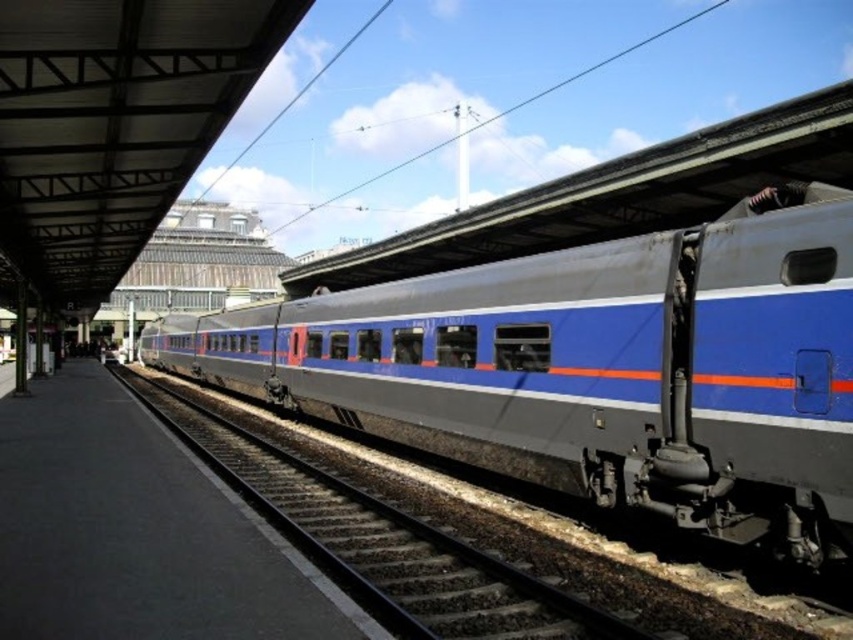
Question: Does metallic blue train at center have a smaller size compared to metal train track at center?

Choices:
 (A) yes
 (B) no

Answer: (B)

Question: Is metallic blue train at center further to camera compared to metal train track at center?

Choices:
 (A) no
 (B) yes

Answer: (B)

Question: Which object appears farthest from the camera in this image?

Choices:
 (A) metallic blue train at center
 (B) metal train track at center

Answer: (A)

Question: Is metallic blue train at center closer to camera compared to metal train track at center?

Choices:
 (A) no
 (B) yes

Answer: (A)